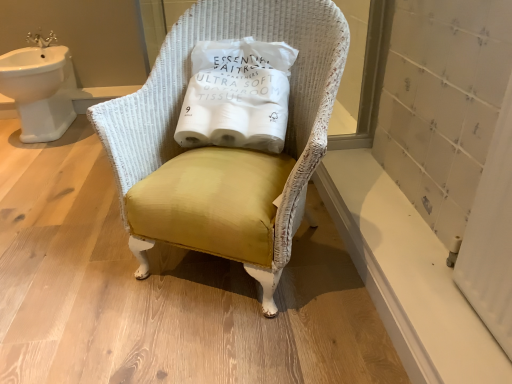
Question: From the image's perspective, is white paper toilet paper at center over white smooth window sill at lower right?

Choices:
 (A) no
 (B) yes

Answer: (B)

Question: Considering the relative sizes of white paper toilet paper at center and white smooth window sill at lower right in the image provided, is white paper toilet paper at center shorter than white smooth window sill at lower right?

Choices:
 (A) yes
 (B) no

Answer: (B)

Question: Is white paper toilet paper at center touching white smooth window sill at lower right?

Choices:
 (A) no
 (B) yes

Answer: (A)

Question: Does white paper toilet paper at center come in front of white smooth window sill at lower right?

Choices:
 (A) no
 (B) yes

Answer: (A)

Question: Could white smooth window sill at lower right be considered to be inside white paper toilet paper at center?

Choices:
 (A) no
 (B) yes

Answer: (A)

Question: Choose the correct answer: Is white smooth window sill at lower right inside white paper toilet paper at center or outside it?

Choices:
 (A) outside
 (B) inside

Answer: (A)

Question: From the image's perspective, is white smooth window sill at lower right above or below white paper toilet paper at center?

Choices:
 (A) above
 (B) below

Answer: (B)

Question: In the image, is white smooth window sill at lower right on the left side or the right side of white paper toilet paper at center?

Choices:
 (A) left
 (B) right

Answer: (B)

Question: Looking at the image, does white smooth window sill at lower right seem bigger or smaller compared to white paper toilet paper at center?

Choices:
 (A) small
 (B) big

Answer: (A)

Question: Based on their sizes in the image, would you say mustard velvet chair at center is bigger or smaller than white paper toilet paper at center?

Choices:
 (A) small
 (B) big

Answer: (B)

Question: From their relative heights in the image, would you say mustard velvet chair at center is taller or shorter than white paper toilet paper at center?

Choices:
 (A) short
 (B) tall

Answer: (B)

Question: Is mustard velvet chair at center situated inside white paper toilet paper at center or outside?

Choices:
 (A) outside
 (B) inside

Answer: (A)

Question: Is point (275, 271) positioned closer to the camera than point (281, 144)?

Choices:
 (A) closer
 (B) farther

Answer: (A)

Question: From the image's perspective, is white paper toilet paper at center located above or below white smooth window sill at lower right?

Choices:
 (A) above
 (B) below

Answer: (A)

Question: From a real-world perspective, is white paper toilet paper at center above or below white smooth window sill at lower right?

Choices:
 (A) above
 (B) below

Answer: (A)